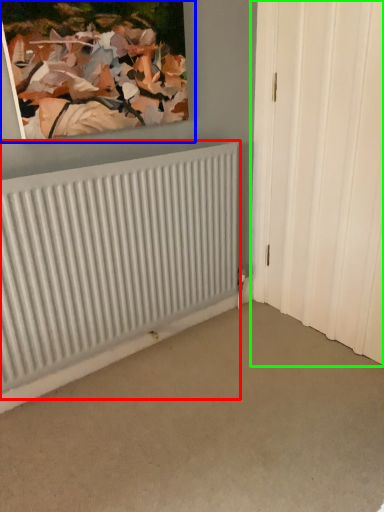
Question: Which object is the farthest from radiator (highlighted by a red box)? Choose among these: picture frame (highlighted by a blue box) or door (highlighted by a green box).

Choices:
 (A) picture frame
 (B) door

Answer: (B)